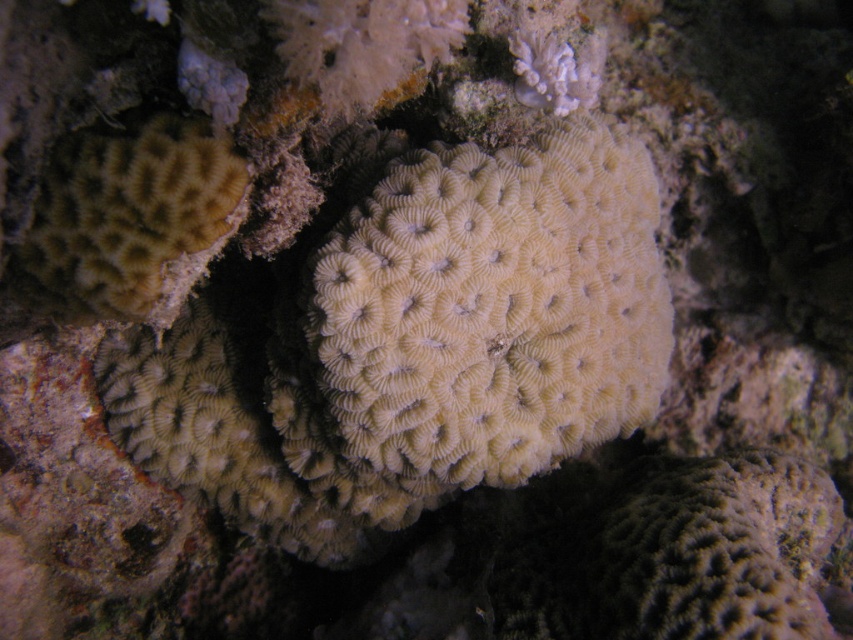
Question: In this image, where is white matte coral at center located relative to light brown textured coral at left?

Choices:
 (A) above
 (B) below

Answer: (B)

Question: Is white matte coral at center below light brown textured coral at left?

Choices:
 (A) no
 (B) yes

Answer: (B)

Question: Among these points, which one is nearest to the camera?

Choices:
 (A) (119, 310)
 (B) (572, 212)

Answer: (A)

Question: Which point is farther to the camera?

Choices:
 (A) (86, 161)
 (B) (405, 177)

Answer: (B)

Question: Is white matte coral at center further to camera compared to light brown textured coral at left?

Choices:
 (A) no
 (B) yes

Answer: (B)